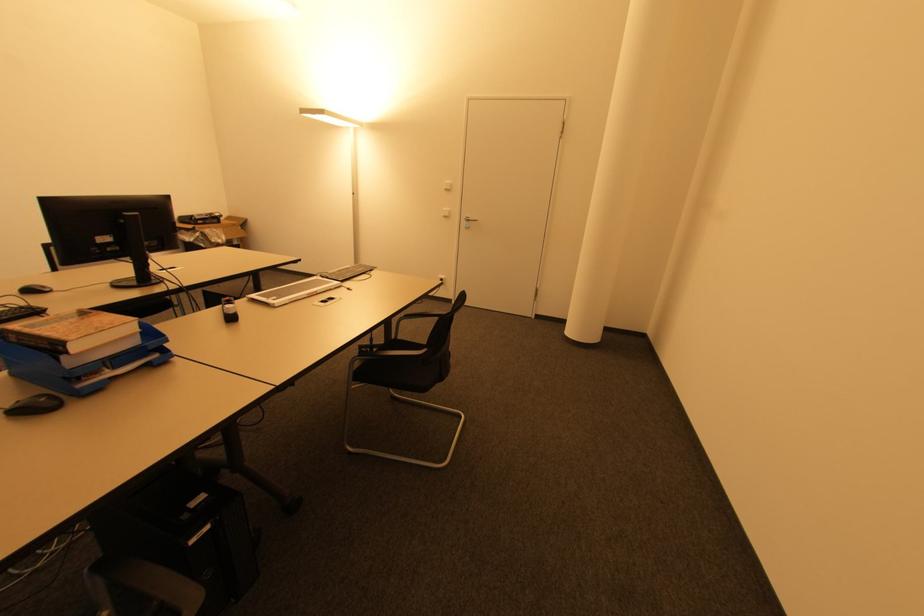
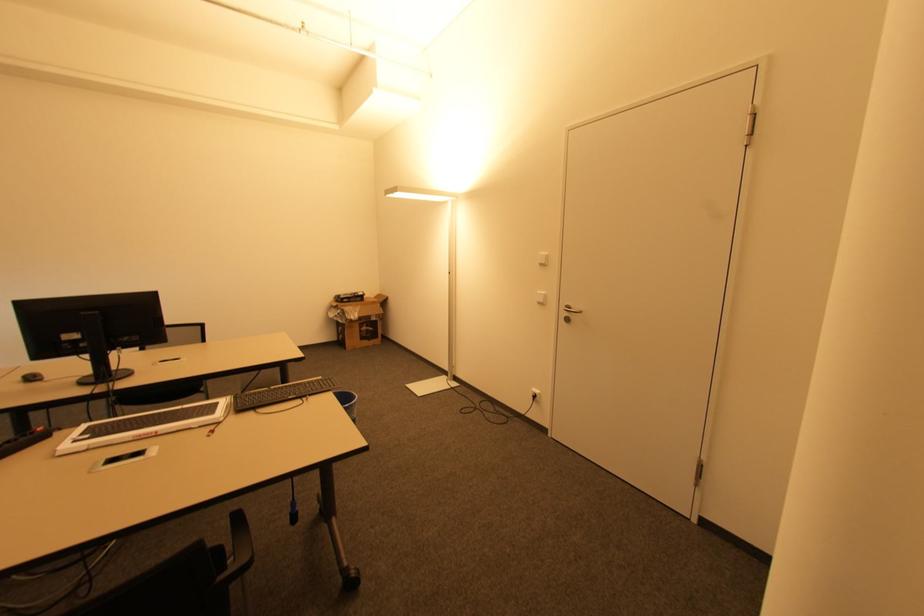
In the second image, find the point that corresponds to [448,190] in the first image.

(542, 265)